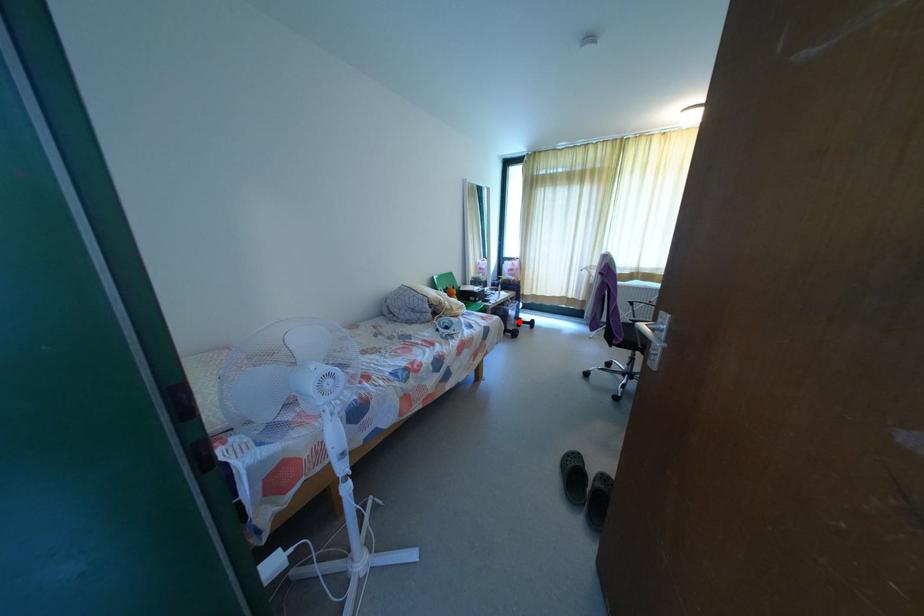
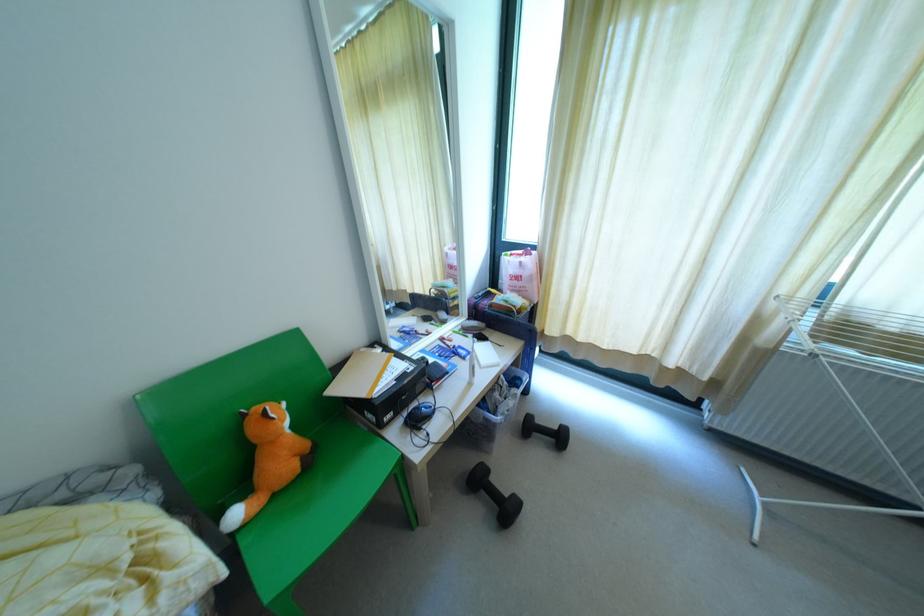
The point at the highlighted location is marked in the first image. Where is the corresponding point in the second image?

(529, 428)